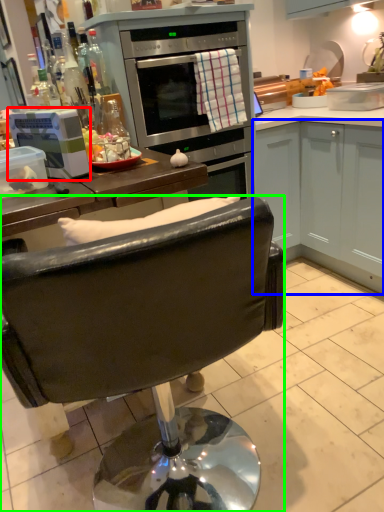
Question: Estimate the real-world distances between objects in this image. Which object is farther from kitchen appliance (highlighted by a red box), cabinetry (highlighted by a blue box) or chair (highlighted by a green box)?

Choices:
 (A) cabinetry
 (B) chair

Answer: (A)